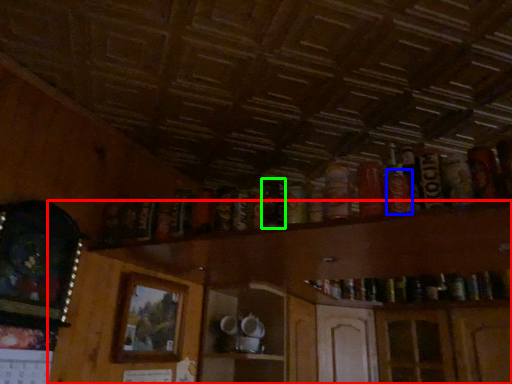
Question: Which object is positioned farthest from dresser (highlighted by a red box)? Select from beer (highlighted by a blue box) and beer (highlighted by a green box).

Choices:
 (A) beer
 (B) beer

Answer: (A)